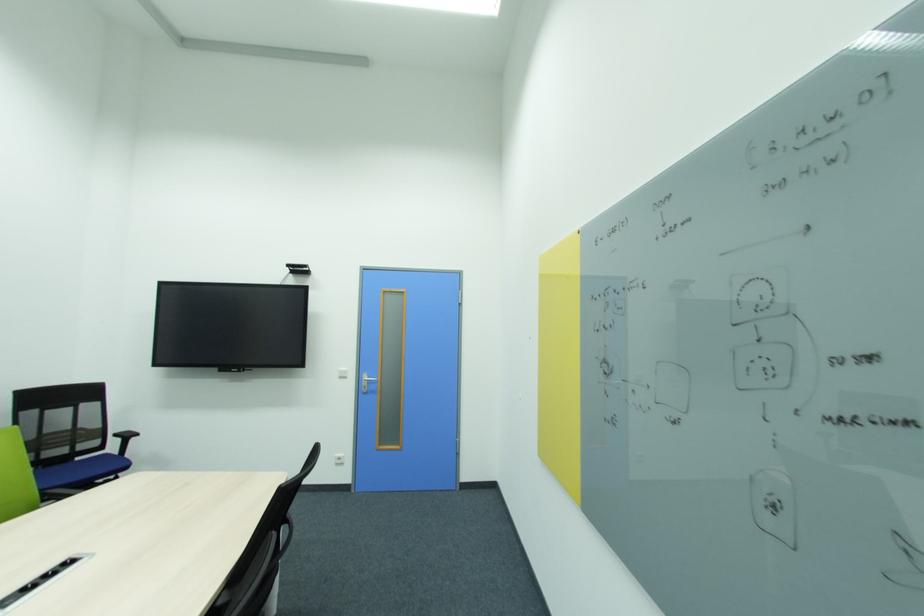
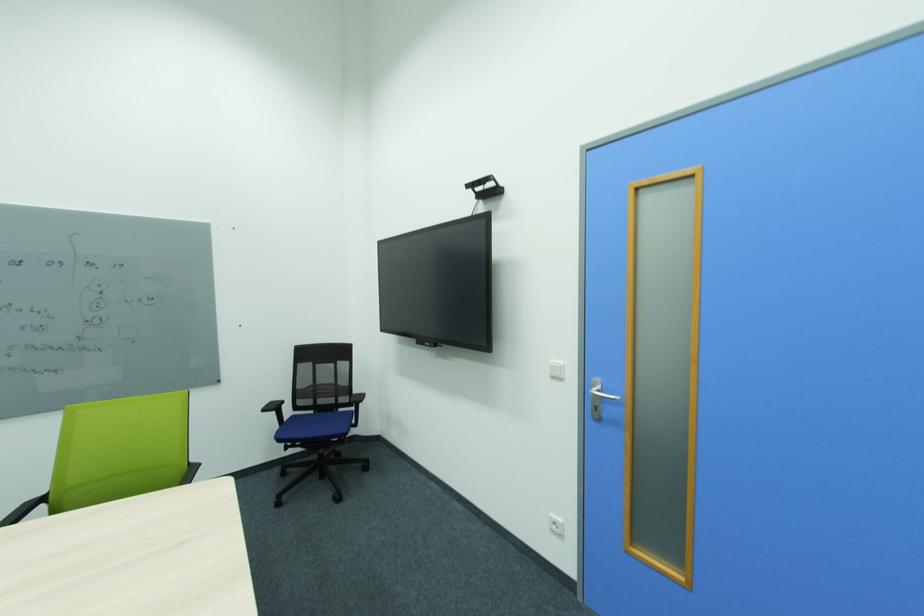
In the second image, find the point that corresponds to the point at 344,459 in the first image.

(560, 525)